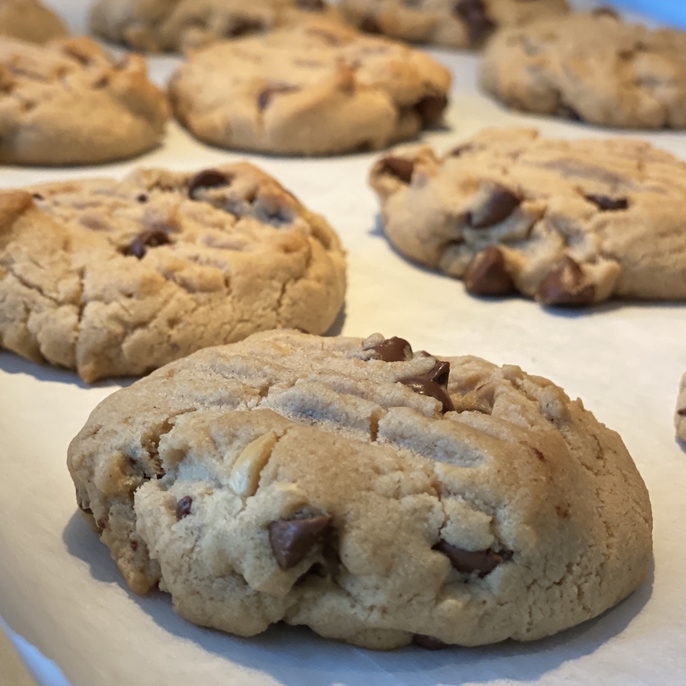
This screenshot has height=686, width=686. What are the coordinates of `beige counter top` in the screenshot? It's located at (440, 322).